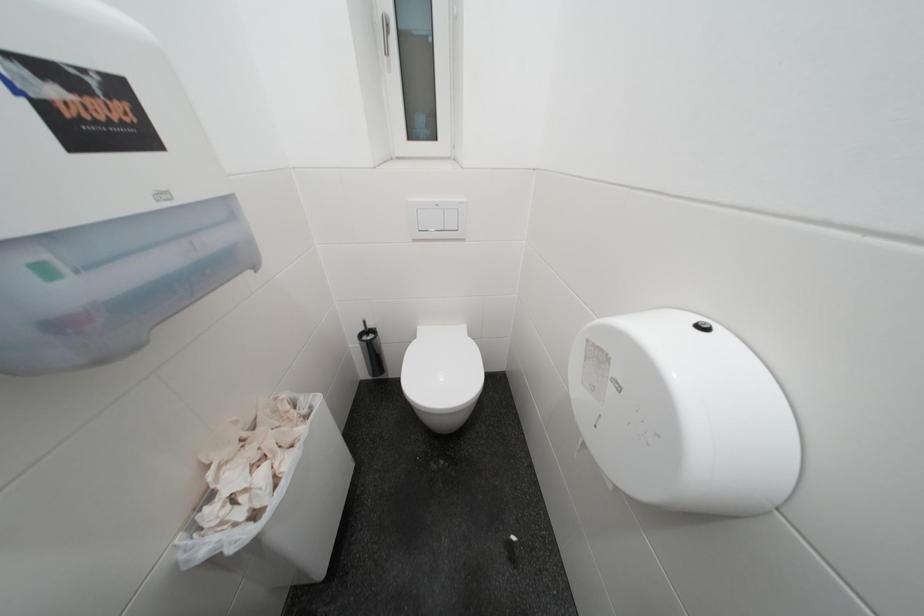
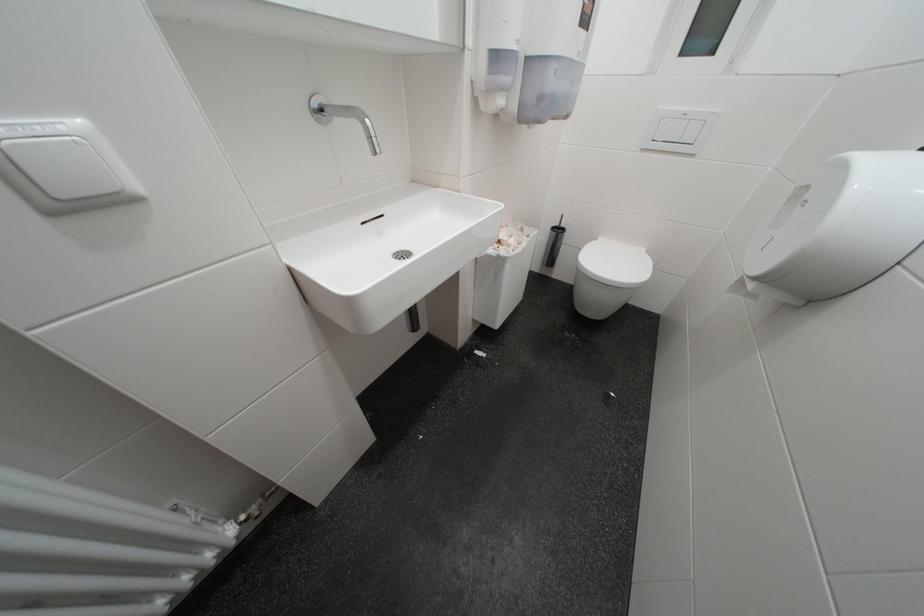
Question: The camera is either moving clockwise (left) or counter-clockwise (right) around the object. The first image is from the beginning of the video and the second image is from the end. Is the camera moving left or right when shooting the video?

Choices:
 (A) Left
 (B) Right

Answer: (B)